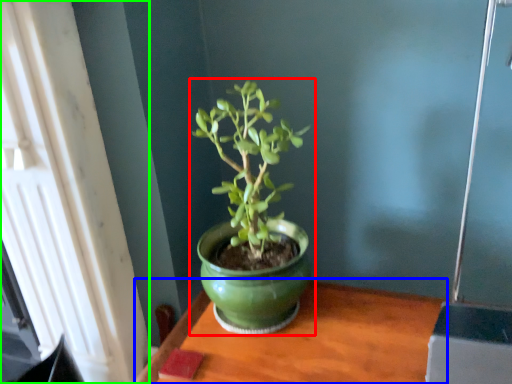
Question: Based on their relative distances, which object is nearer to houseplant (highlighted by a red box)? Choose from table (highlighted by a blue box) and window (highlighted by a green box).

Choices:
 (A) table
 (B) window

Answer: (A)